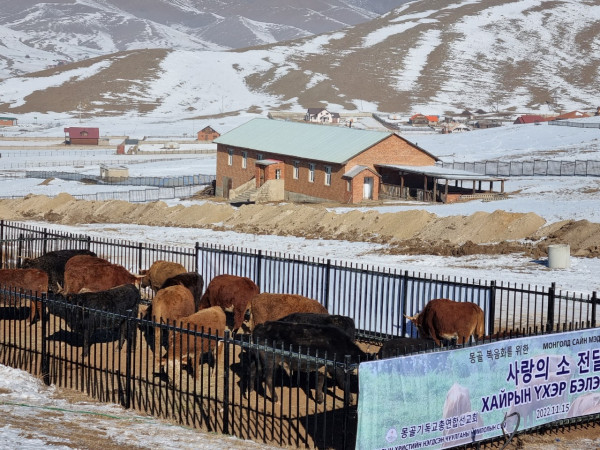
At what (x,y) coordinates should I click in order to perform the action: click on doors. Please return your answer as a coordinate pair (x, y). Image resolution: width=600 pixels, height=450 pixels. Looking at the image, I should click on pos(371,193), pos(263,181).